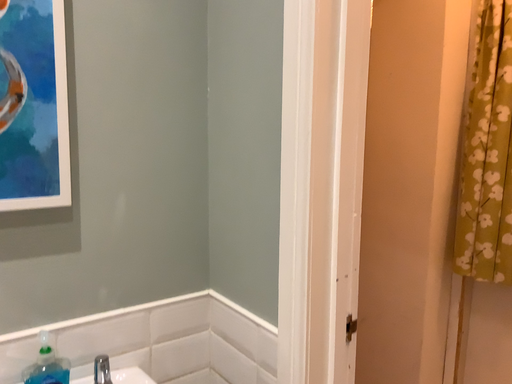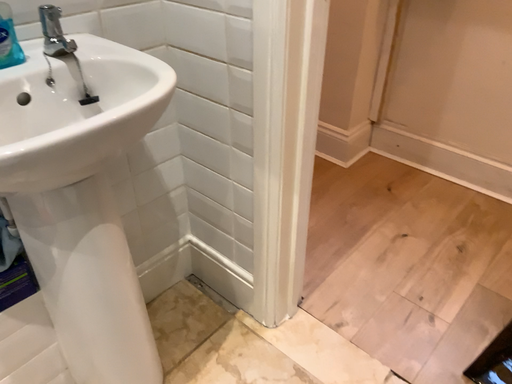
Question: How did the camera likely rotate when shooting the video?

Choices:
 (A) rotated left
 (B) rotated right

Answer: (B)